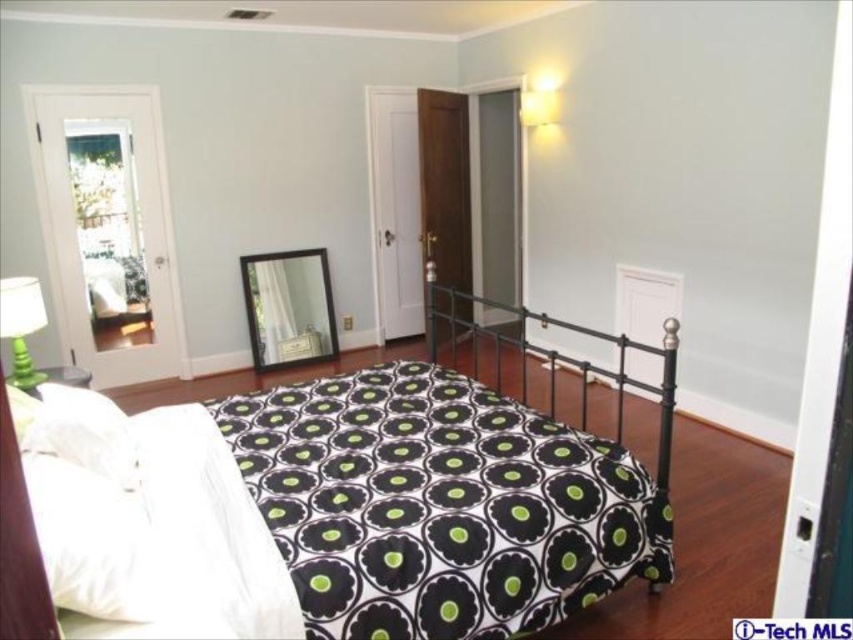
Question: Among these points, which one is nearest to the camera?

Choices:
 (A) (537, 108)
 (B) (39, 298)
 (C) (85, 456)
 (D) (480, 554)

Answer: (C)

Question: Is black matte bed at center closer to camera compared to green matte lampshade at left?

Choices:
 (A) yes
 (B) no

Answer: (A)

Question: Can you confirm if white soft pillow at lower left is positioned to the right of matte white lampshade at upper right?

Choices:
 (A) yes
 (B) no

Answer: (B)

Question: Among these objects, which one is nearest to the camera?

Choices:
 (A) black matte bed at center
 (B) white soft pillow at lower left
 (C) matte white lampshade at upper right
 (D) green matte lampshade at left

Answer: (A)

Question: Among these points, which one is farthest from the camera?

Choices:
 (A) (113, 486)
 (B) (27, 353)

Answer: (B)

Question: Is green matte lampshade at left positioned at the back of matte white lampshade at upper right?

Choices:
 (A) no
 (B) yes

Answer: (A)